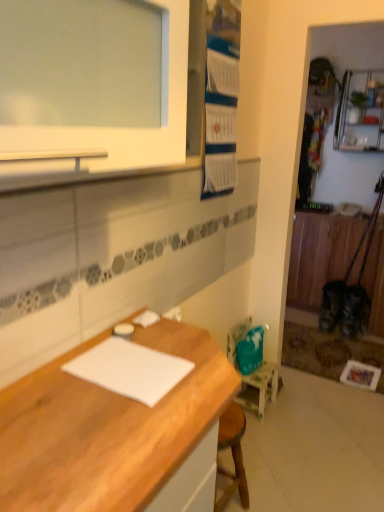
You are a GUI agent. You are given a task and a screenshot of the screen. Output one action in this format:
    pyautogui.click(x=<x>, y=<y>)
    Task: Click on the unoccupied region to the right of white paper at center
    The image size is (384, 512).
    Given the screenshot: What is the action you would take?
    pyautogui.click(x=202, y=368)